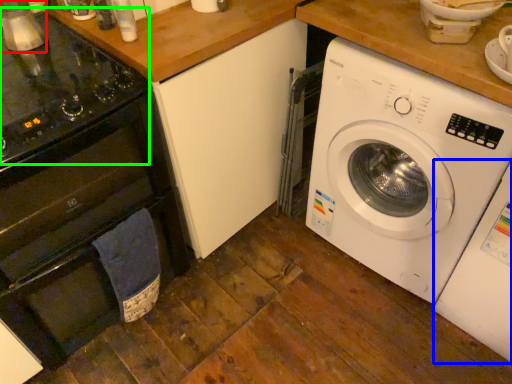
Question: Which object is positioned closest to appliance (highlighted by a red box)? Select from washing machine (highlighted by a blue box) and gas stove (highlighted by a green box).

Choices:
 (A) washing machine
 (B) gas stove

Answer: (B)